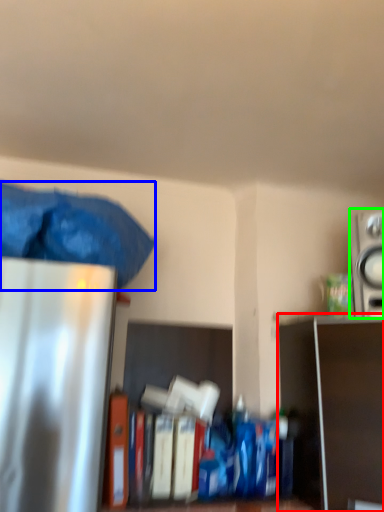
Question: Estimate the real-world distances between objects in this image. Which object is closer to shelf (highlighted by a red box), waste (highlighted by a blue box) or appliance (highlighted by a green box)?

Choices:
 (A) waste
 (B) appliance

Answer: (B)